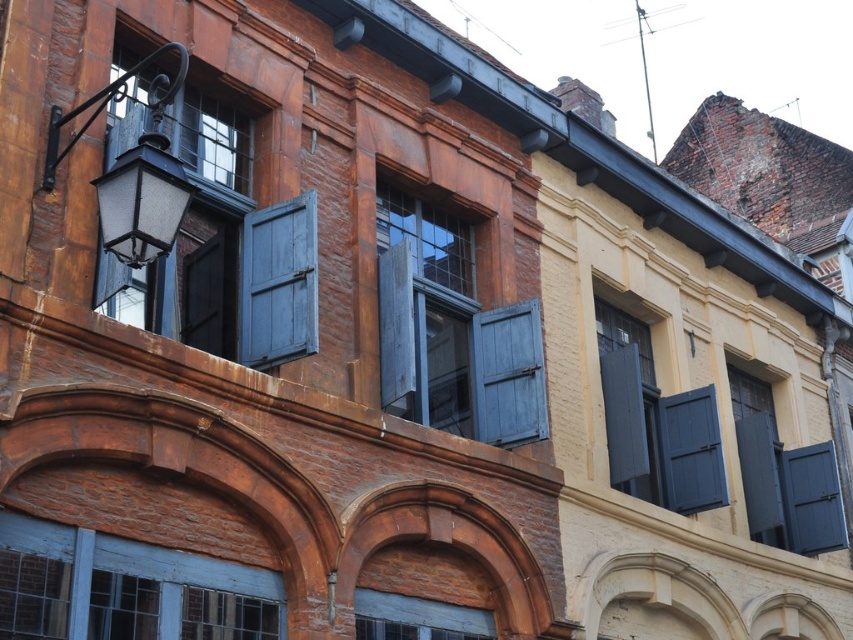
You are an architect assessing the historic building. You need to determine which object, the blue painted wood window at lower left or the dark blue wood shutter at lower right, requires more vertical space for installation. Based on the scene, which one would you prioritize for a taller opening?

The blue painted wood window at lower left is taller than the dark blue wood shutter at lower right, so it would require more vertical space and should be prioritized for a taller opening.

You are an architect examining the historic building. You notice the wooden at center and the matte gray wooden window at center. Which object is located above the other?

The wooden at center is positioned over the matte gray wooden window at center, meaning it is above the window.